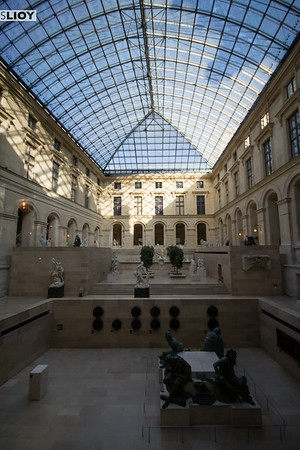
Locate an element on the screen. The width and height of the screenshot is (300, 450). stone floor is located at coordinates (110, 399).